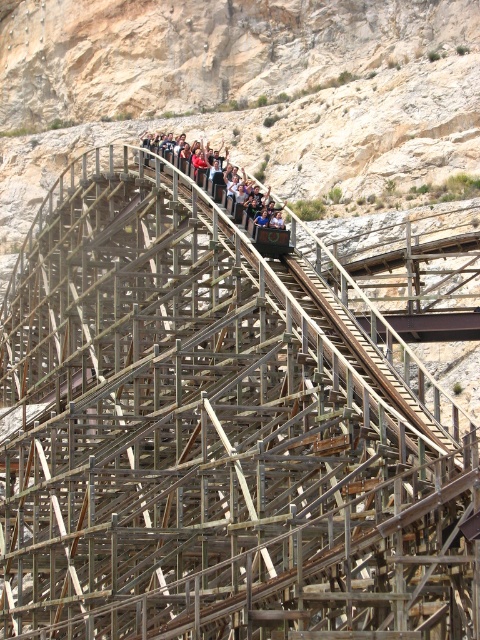
Does point (86, 26) come in front of point (269, 188)?

No, it is not.

Between point (444, 122) and point (250, 180), which one is positioned in front?

Point (250, 180) is in front.

Does point (370, 124) come in front of point (224, 200)?

No, it is not.

The width and height of the screenshot is (480, 640). I want to click on wooden roller coaster at upper center, so click(x=242, y=88).